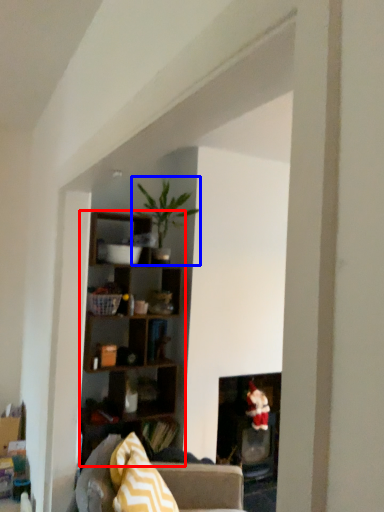
Question: Which object is further to the camera taking this photo, shelf (highlighted by a red box) or houseplant (highlighted by a blue box)?

Choices:
 (A) shelf
 (B) houseplant

Answer: (B)